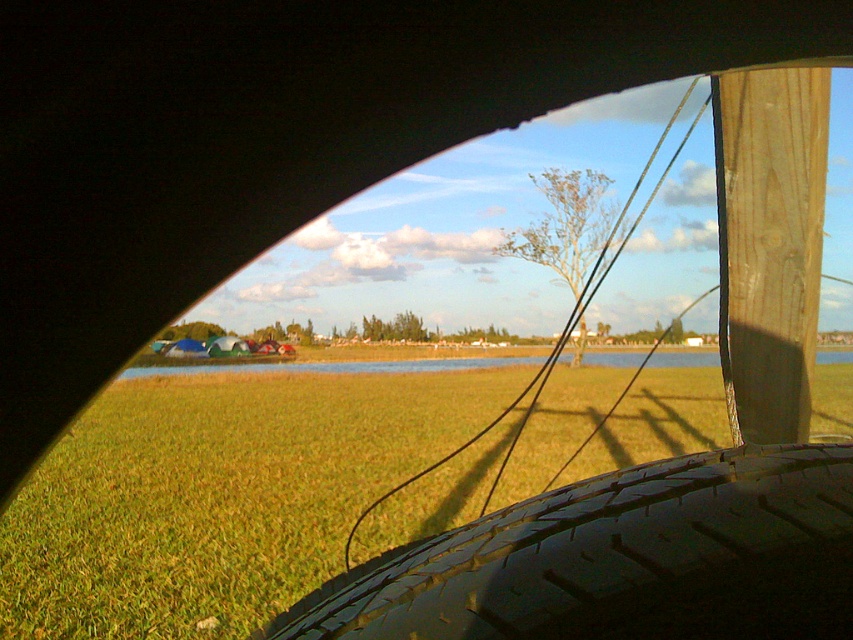
Is green grass at lower left further to camera compared to black rubber tire at lower right?

Yes, it is.

Is green grass at lower left smaller than black rubber tire at lower right?

No.

Between point (68, 593) and point (827, 472), which one is positioned in front?

Point (827, 472) is in front.

Image resolution: width=853 pixels, height=640 pixels. I want to click on green grass at lower left, so click(x=218, y=496).

Who is shorter, black rubber tire at lower right or wooden post at upper right?

Standing shorter between the two is black rubber tire at lower right.

Where is `black rubber tire at lower right`? black rubber tire at lower right is located at coordinates (628, 557).

Between green grass at lower left and wooden post at upper right, which one appears on the left side from the viewer's perspective?

wooden post at upper right

Can you confirm if green grass at lower left is taller than wooden post at upper right?

Indeed, green grass at lower left has a greater height compared to wooden post at upper right.

Does point (612, 394) lie in front of point (735, 388)?

No, it is not.

Locate an element on the screen. The image size is (853, 640). green grass at lower left is located at coordinates (218, 496).